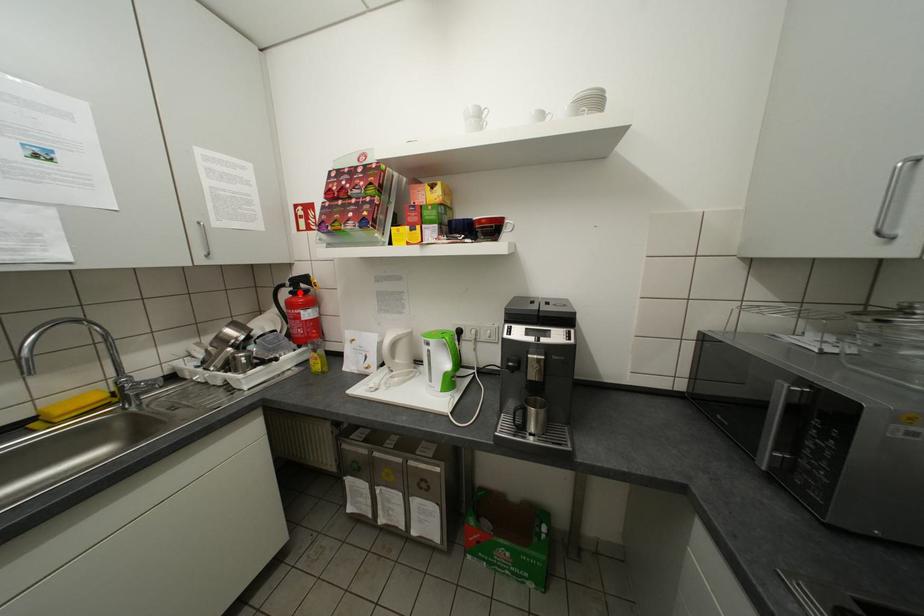
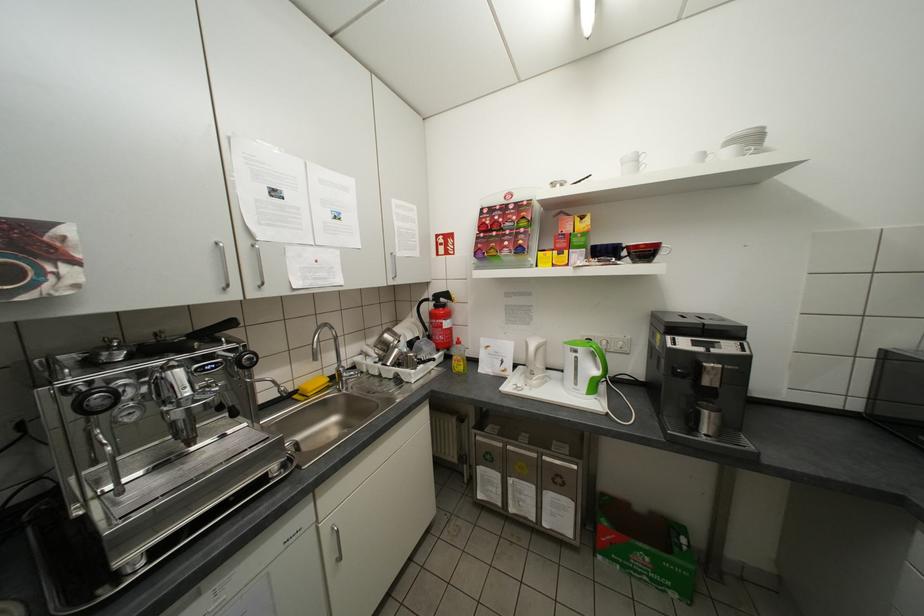
Where in the second image is the point corresponding to the highlighted location from the first image?

(444, 306)